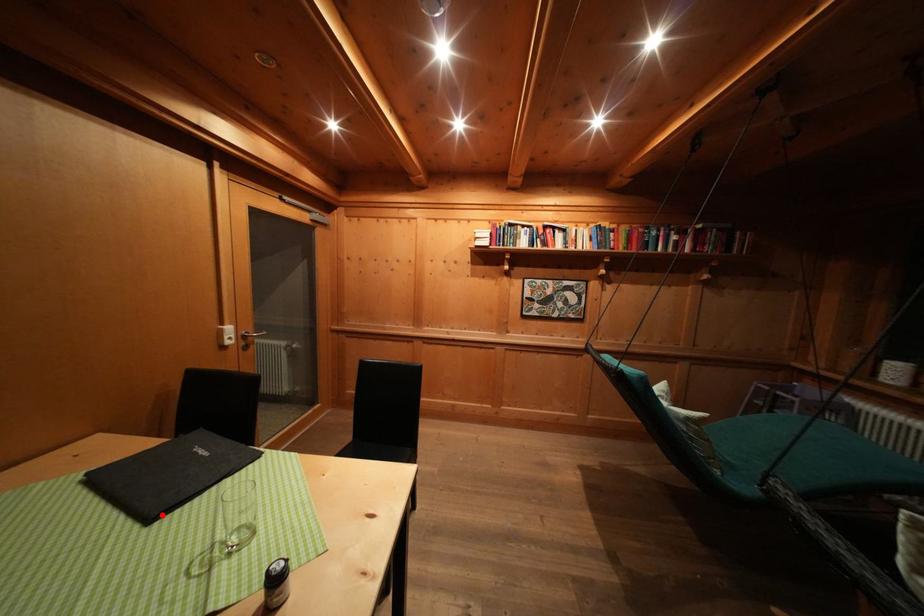
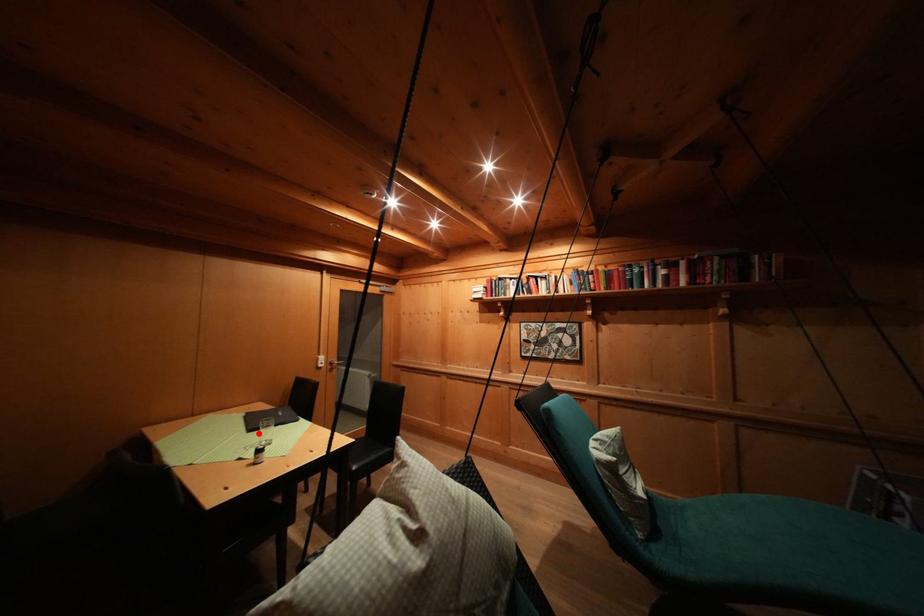
I am providing you with two images of the same scene from different viewpoints. A red point is marked on the first image and another point is marked on the second image. Does the point marked in image1 correspond to the same location as the one in image2?

Yes